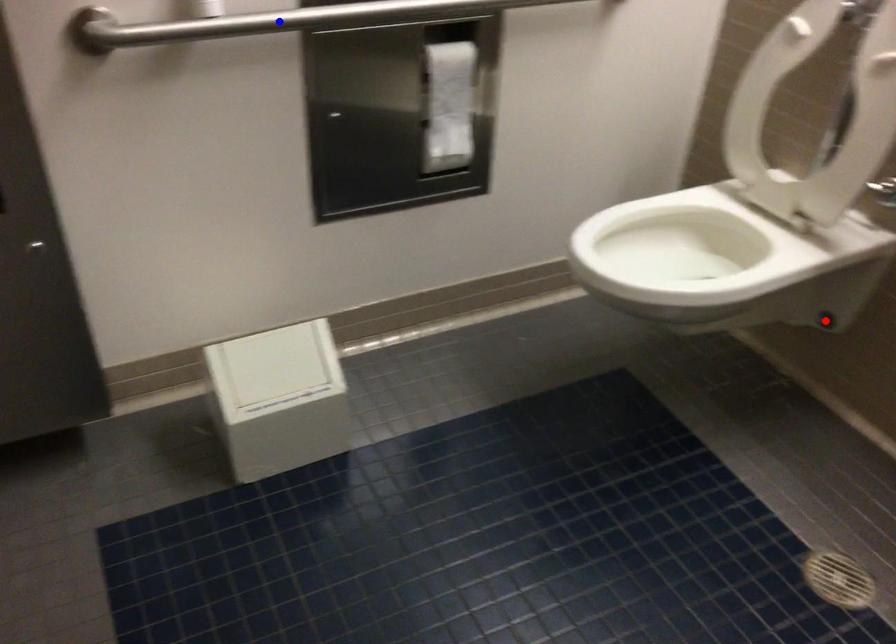
Question: In the image, two points are highlighted. Which point is nearer to the camera? Reply with the corresponding letter.

Choices:
 (A) blue point
 (B) red point

Answer: (A)